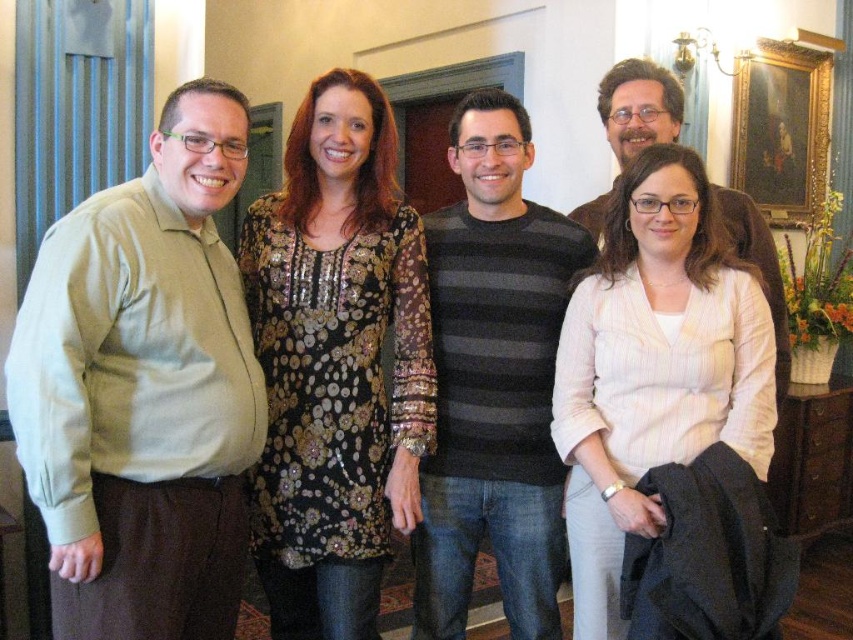
You are organizing a charity event and need to determine which of the two center garments, the shiny sequined dress at center and the white striped blazer at center, can fit into a standard garment box. The box can only accommodate items smaller than the blazer. Which garment should you choose?

The shiny sequined dress at center has a smaller size compared to the white striped blazer at center. Therefore, the shiny sequined dress at center should be chosen as it fits within the box size requirement.